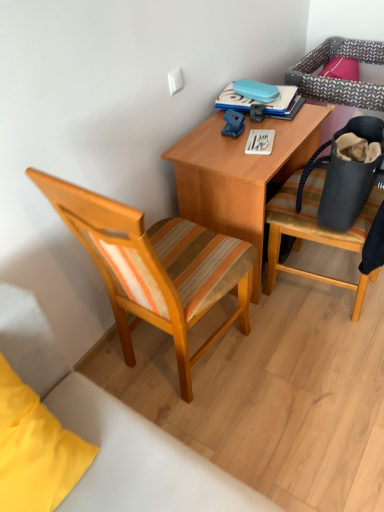
Find the location of a particular element. This screenshot has width=384, height=512. vacant area that is in front of wooden striped cushioned chair at right, the 1th chair positioned from the right is located at coordinates (325, 369).